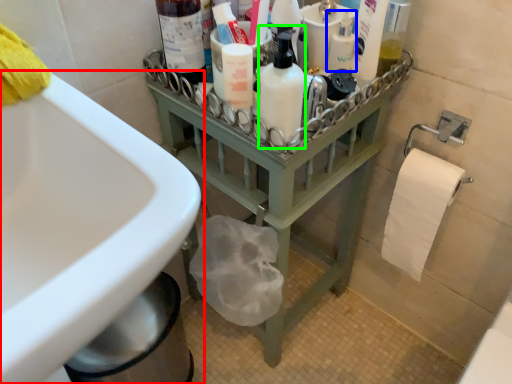
Question: Considering the real-world distances, which object is closest to sink (highlighted by a red box)? mouthwash (highlighted by a blue box) or cleaning product (highlighted by a green box).

Choices:
 (A) mouthwash
 (B) cleaning product

Answer: (B)